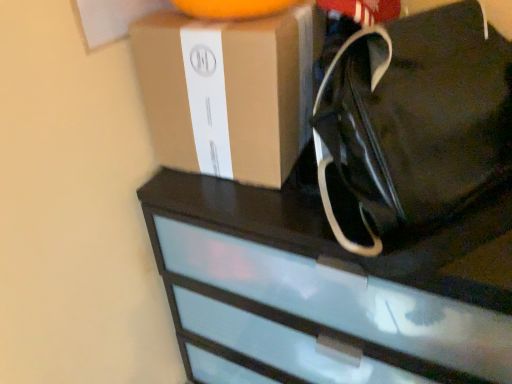
Question: Is brown cardboard box at upper center a part of black fabric tote at upper right?

Choices:
 (A) no
 (B) yes

Answer: (A)

Question: Would you consider black fabric tote at upper right to be distant from brown cardboard box at upper center?

Choices:
 (A) yes
 (B) no

Answer: (B)

Question: From the image's perspective, does black fabric tote at upper right appear lower than brown cardboard box at upper center?

Choices:
 (A) no
 (B) yes

Answer: (B)

Question: Is black fabric tote at upper right placed right next to brown cardboard box at upper center?

Choices:
 (A) no
 (B) yes

Answer: (A)

Question: Does black fabric tote at upper right have a lesser height compared to brown cardboard box at upper center?

Choices:
 (A) no
 (B) yes

Answer: (A)

Question: From a real-world perspective, is black fabric tote at upper right above or below brown cardboard box at upper center?

Choices:
 (A) above
 (B) below

Answer: (A)

Question: Relative to brown cardboard box at upper center, is black fabric tote at upper right in front or behind?

Choices:
 (A) behind
 (B) front

Answer: (B)

Question: Is black fabric tote at upper right to the left or to the right of brown cardboard box at upper center in the image?

Choices:
 (A) left
 (B) right

Answer: (B)

Question: In terms of width, does black fabric tote at upper right look wider or thinner when compared to brown cardboard box at upper center?

Choices:
 (A) wide
 (B) thin

Answer: (B)

Question: From the image's perspective, relative to black fabric tote at upper right, is black glossy chest of drawers at upper center above or below?

Choices:
 (A) above
 (B) below

Answer: (B)

Question: Based on their sizes in the image, would you say black glossy chest of drawers at upper center is bigger or smaller than black fabric tote at upper right?

Choices:
 (A) small
 (B) big

Answer: (B)

Question: Considering the positions of point click(168, 279) and point click(455, 198), is point click(168, 279) closer or farther from the camera than point click(455, 198)?

Choices:
 (A) closer
 (B) farther

Answer: (B)

Question: In the image, is black glossy chest of drawers at upper center positioned in front of or behind black fabric tote at upper right?

Choices:
 (A) behind
 (B) front

Answer: (A)

Question: Considering the positions of brown cardboard box at upper center and black fabric tote at upper right in the image, is brown cardboard box at upper center wider or thinner than black fabric tote at upper right?

Choices:
 (A) thin
 (B) wide

Answer: (B)

Question: Is brown cardboard box at upper center spatially inside black fabric tote at upper right, or outside of it?

Choices:
 (A) inside
 (B) outside

Answer: (B)